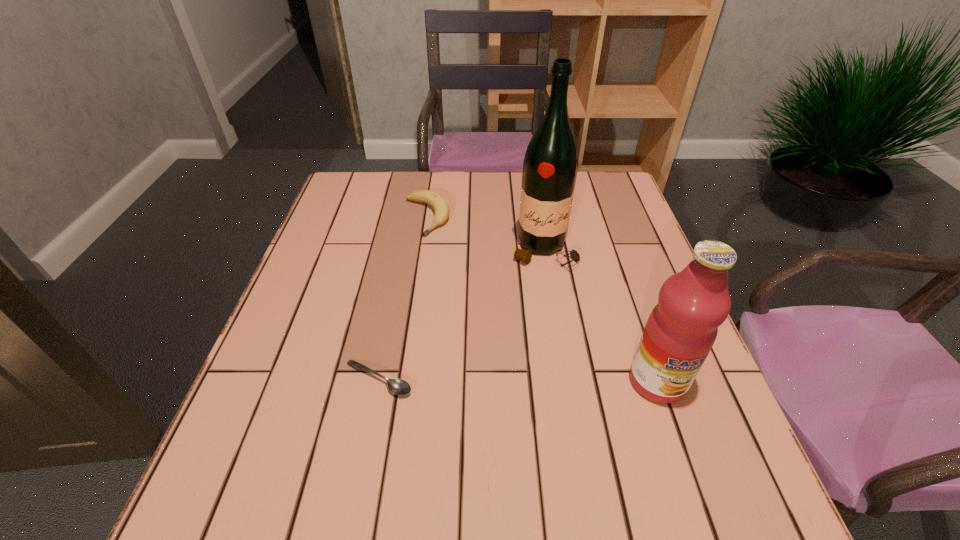
In the image, there is a desktop. Identify the location of free region at the far right corner. (596, 197).

Where is `free space between the tallest object and the third tallest object`? The image size is (960, 540). free space between the tallest object and the third tallest object is located at coordinates (485, 233).

Find the location of a particular element. This screenshot has width=960, height=540. free space between the shortest object and the fruit juice is located at coordinates (517, 380).

At what (x,y) coordinates should I click in order to perform the action: click on empty location between the banana and the third shortest object. Please return your answer as a coordinate pair (x, y). Looking at the image, I should click on (542, 299).

I want to click on free space between the shortest object and the rightmost object, so click(x=517, y=380).

Where is `vacant point located between the tallest object and the banana`? vacant point located between the tallest object and the banana is located at coordinates (485, 233).

At what (x,y) coordinates should I click in order to perform the action: click on empty location between the third object from left to right and the rightmost object. Please return your answer as a coordinate pair (x, y). Looking at the image, I should click on (601, 315).

At what (x,y) coordinates should I click in order to perform the action: click on vacant space that's between the tallest object and the second shortest object. Please return your answer as a coordinate pair (x, y). This screenshot has height=540, width=960. Looking at the image, I should click on (485, 233).

The height and width of the screenshot is (540, 960). In order to click on free space between the soupspoon and the wine bottle in this screenshot , I will do `click(461, 314)`.

I want to click on free area in between the tallest object and the shortest object, so click(461, 314).